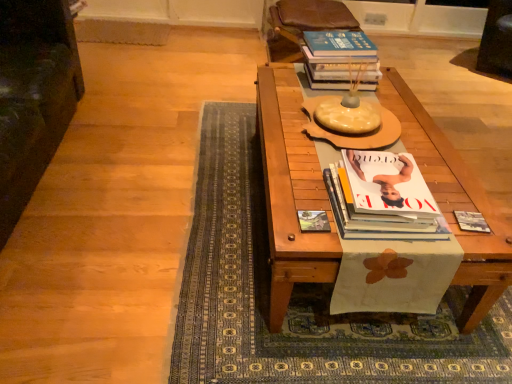
This screenshot has height=384, width=512. Find the location of `free space to the right of blue hardcover book at upper right, the 1th book in the top-to-bottom sequence`. free space to the right of blue hardcover book at upper right, the 1th book in the top-to-bottom sequence is located at coordinates (396, 92).